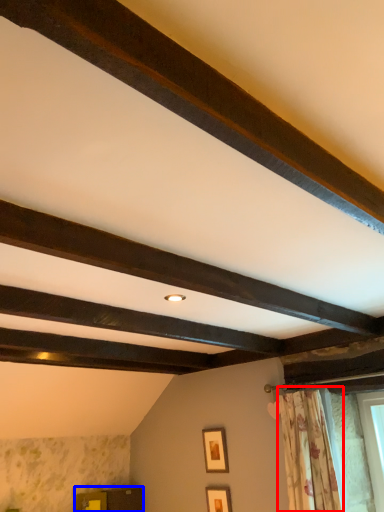
Question: Among these objects, which one is farthest to the camera, curtain (highlighted by a red box) or furniture (highlighted by a blue box)?

Choices:
 (A) curtain
 (B) furniture

Answer: (B)